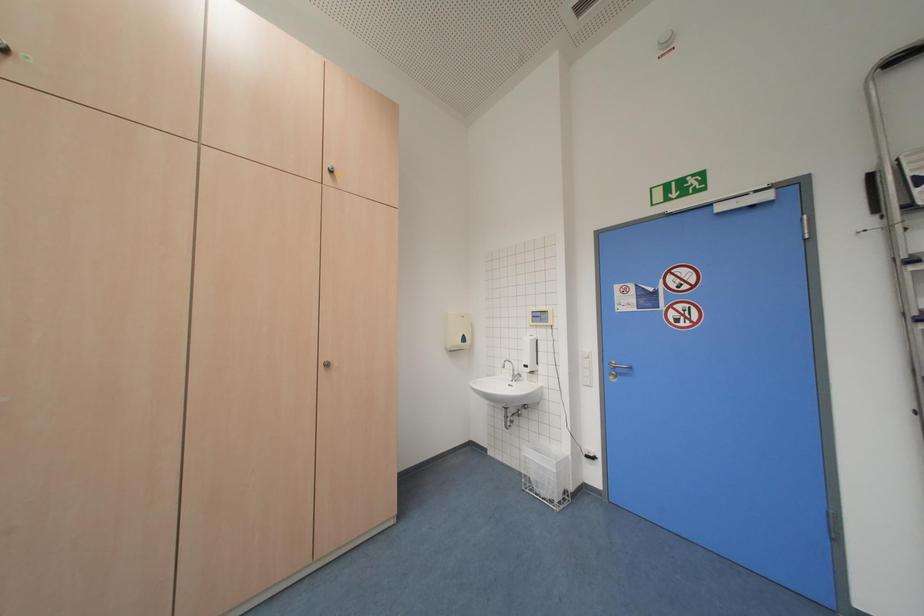
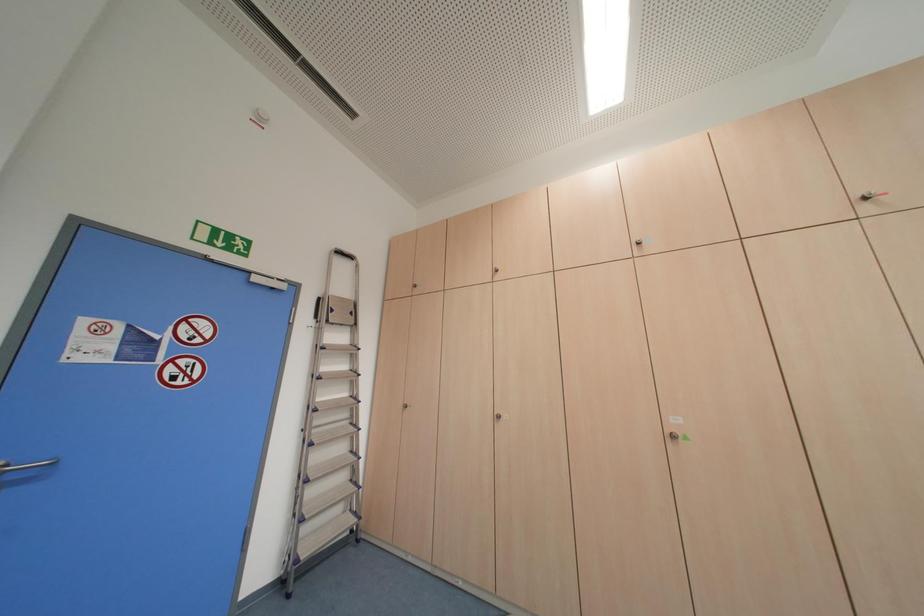
How did the camera likely rotate?

The rotation direction of the camera is right-up.